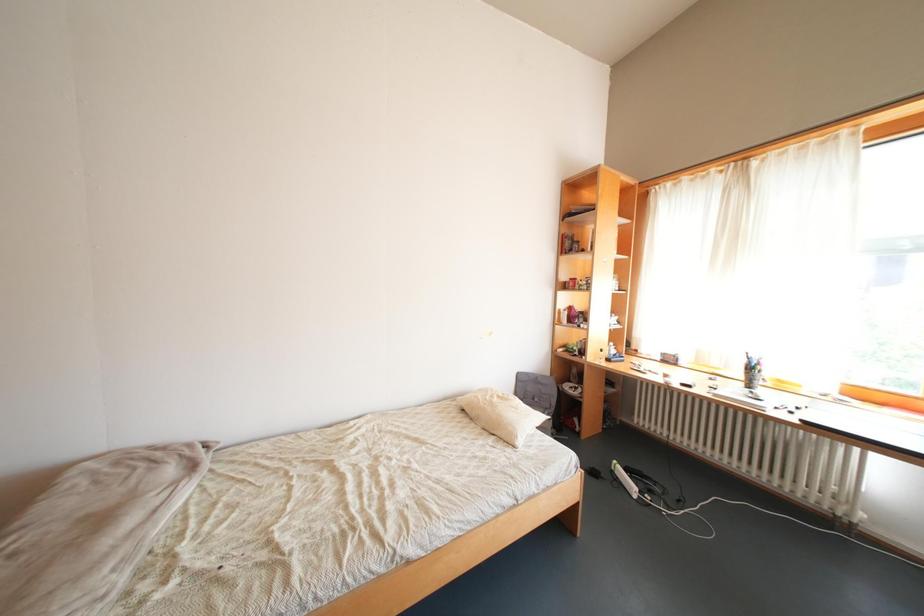
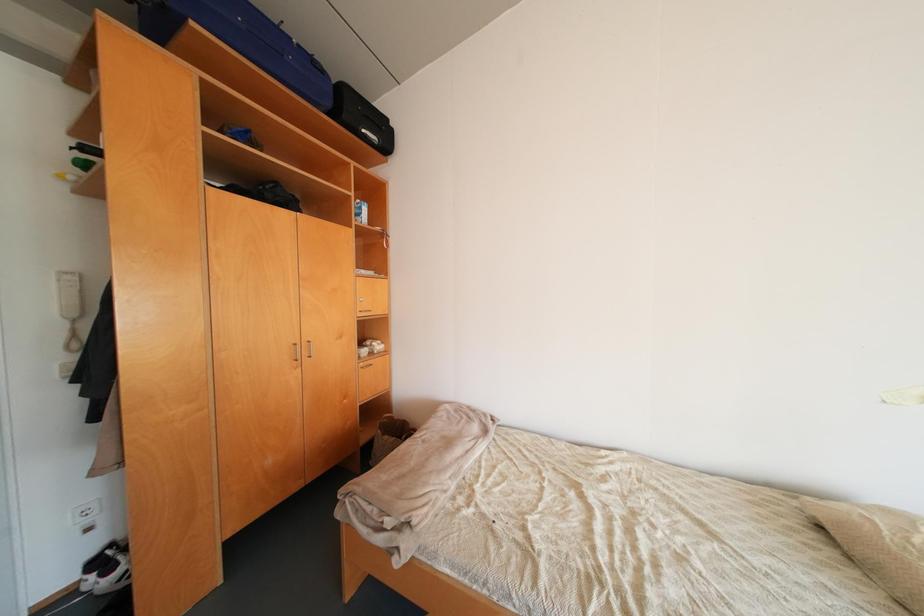
Question: The camera is either moving clockwise (left) or counter-clockwise (right) around the object. The first image is from the beginning of the video and the second image is from the end. Is the camera moving left or right when shooting the video?

Choices:
 (A) Left
 (B) Right

Answer: (B)